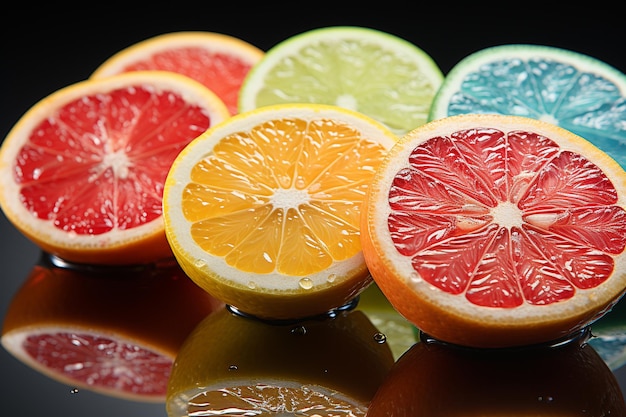
What are the coordinates of `counter top` in the screenshot? It's located at (325, 348).